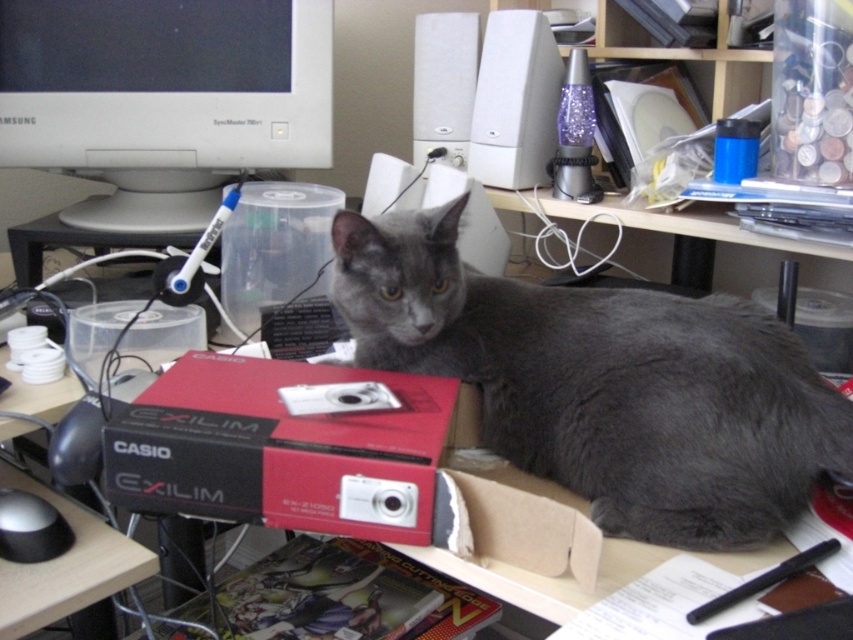
Which is more to the right, cardboard at lower center or black matte mouse at lower left?

cardboard at lower center is more to the right.

Does point (448, 472) lie in front of point (15, 561)?

Yes.

Find the location of a particular element. The height and width of the screenshot is (640, 853). cardboard at lower center is located at coordinates (512, 508).

In order to click on cardboard at lower center in this screenshot , I will do `click(512, 508)`.

Between gray fur cat at center and cardboard at lower center, which one is positioned higher?

Positioned higher is gray fur cat at center.

Is gray fur cat at center below cardboard at lower center?

Actually, gray fur cat at center is above cardboard at lower center.

Who is more forward, (543,385) or (454,422)?

Positioned in front is point (543,385).

Locate an element on the screen. This screenshot has height=640, width=853. gray fur cat at center is located at coordinates coord(602,384).

How distant is white glossy computer monitor at upper left from red matte casio exilim box at center?

55.21 centimeters

Does white glossy computer monitor at upper left appear on the right side of red matte casio exilim box at center?

In fact, white glossy computer monitor at upper left is to the left of red matte casio exilim box at center.

At what (x,y) coordinates should I click in order to perform the action: click on white glossy computer monitor at upper left. Please return your answer as a coordinate pair (x, y). The width and height of the screenshot is (853, 640). Looking at the image, I should click on (163, 99).

What are the coordinates of `white glossy computer monitor at upper left` in the screenshot? It's located at (163, 99).